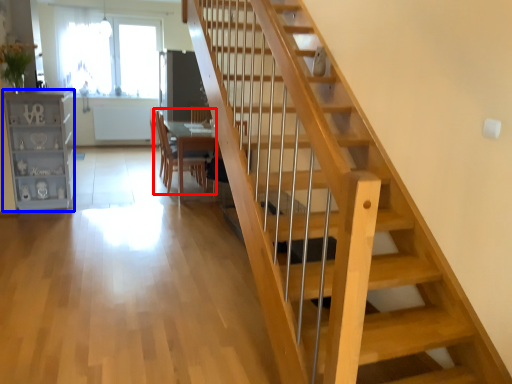
Question: Which object is closer to the camera taking this photo, chair (highlighted by a red box) or bookshelf (highlighted by a blue box)?

Choices:
 (A) chair
 (B) bookshelf

Answer: (B)